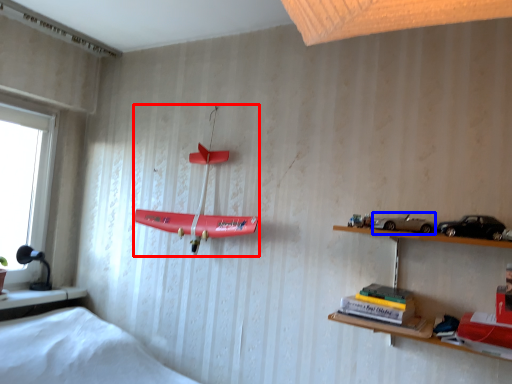
Question: Which object appears farthest to the camera in this image, toy (highlighted by a red box) or toy car (highlighted by a blue box)?

Choices:
 (A) toy
 (B) toy car

Answer: (A)